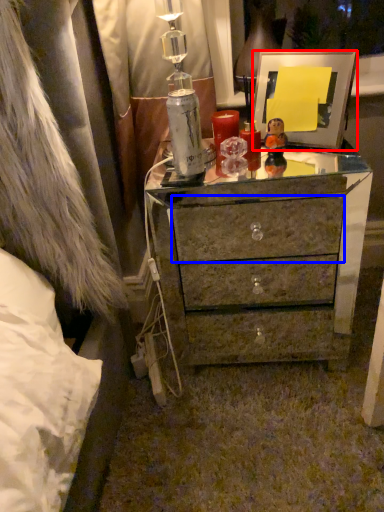
Question: Which of the following is the closest to the observer, picture frame (highlighted by a red box) or drawer (highlighted by a blue box)?

Choices:
 (A) picture frame
 (B) drawer

Answer: (A)